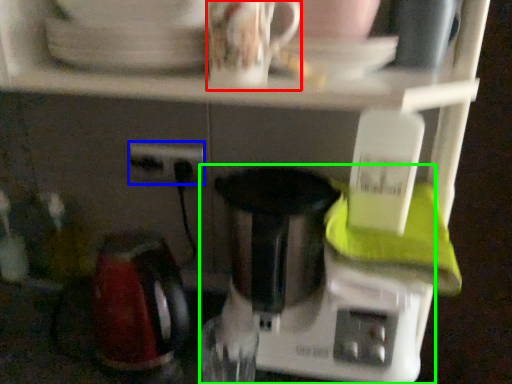
Question: Considering the real-world distances, which object is closest to coffee cup (highlighted by a red box)? power plugs and sockets (highlighted by a blue box) or mixer (highlighted by a green box).

Choices:
 (A) power plugs and sockets
 (B) mixer

Answer: (B)